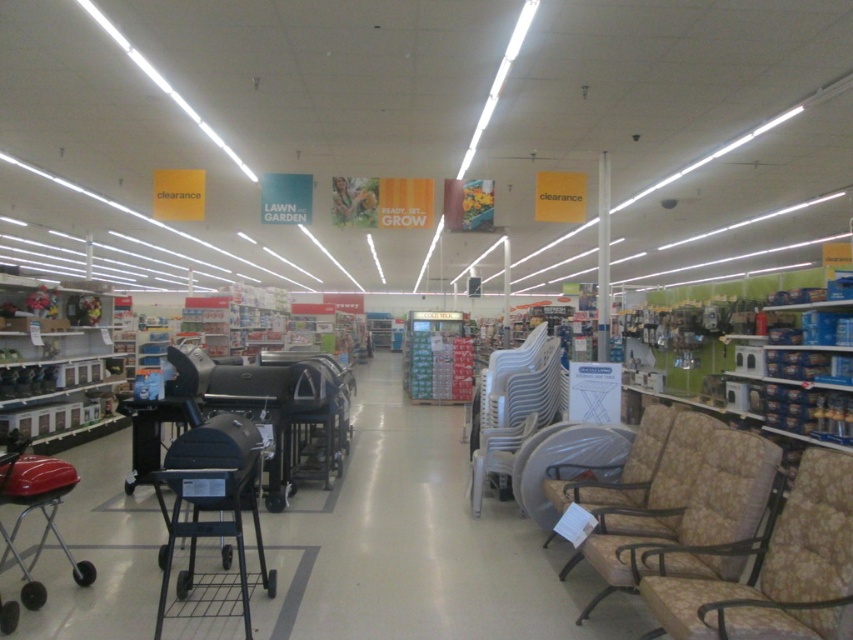
Question: Which of the following is the farthest from the observer?

Choices:
 (A) (503, 451)
 (B) (167, 561)
 (C) (683, 506)
 (D) (36, 461)

Answer: (A)

Question: Where is beige fabric armchair at right located in relation to black matte grill at center-left in the image?

Choices:
 (A) below
 (B) above

Answer: (B)

Question: Among these points, which one is nearest to the camera?

Choices:
 (A) (764, 451)
 (B) (0, 596)
 (C) (705, 589)
 (D) (524, 428)

Answer: (C)

Question: Is floral fabric armchair at lower right wider than beige fabric armchair at right?

Choices:
 (A) no
 (B) yes

Answer: (A)

Question: Is black matte grill at center-left in front of red plastic baby carriage at lower left?

Choices:
 (A) yes
 (B) no

Answer: (A)

Question: Which object is farther from the camera taking this photo?

Choices:
 (A) black matte grill at center-left
 (B) red plastic baby carriage at lower left

Answer: (B)